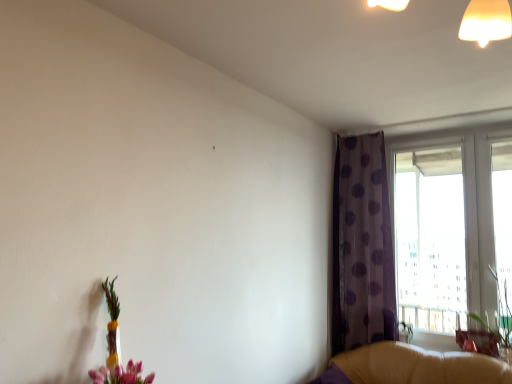
Question: In the image, is purple dotted fabric at upper right on the left side or the right side of translucent glass vase at lower left?

Choices:
 (A) right
 (B) left

Answer: (A)

Question: In terms of size, does purple dotted fabric at upper right appear bigger or smaller than translucent glass vase at lower left?

Choices:
 (A) small
 (B) big

Answer: (B)

Question: Estimate the real-world distances between objects in this image. Which object is closer to the translucent glass vase at lower left?

Choices:
 (A) green leafy plant at right
 (B) transparent glass window at right
 (C) leather couch at lower right
 (D) purple dotted fabric at upper right
 (E) matte brown swivel chair at lower right

Answer: (C)

Question: Which is farther from the green leafy plant at right?

Choices:
 (A) purple dotted fabric at upper right
 (B) leather couch at lower right
 (C) matte brown swivel chair at lower right
 (D) translucent glass vase at lower left
 (E) transparent glass window at right

Answer: (D)